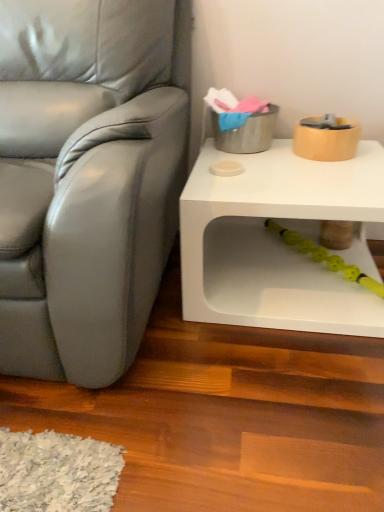
Find the location of `free space in front of white matte table at lower right`. free space in front of white matte table at lower right is located at coordinates (254, 396).